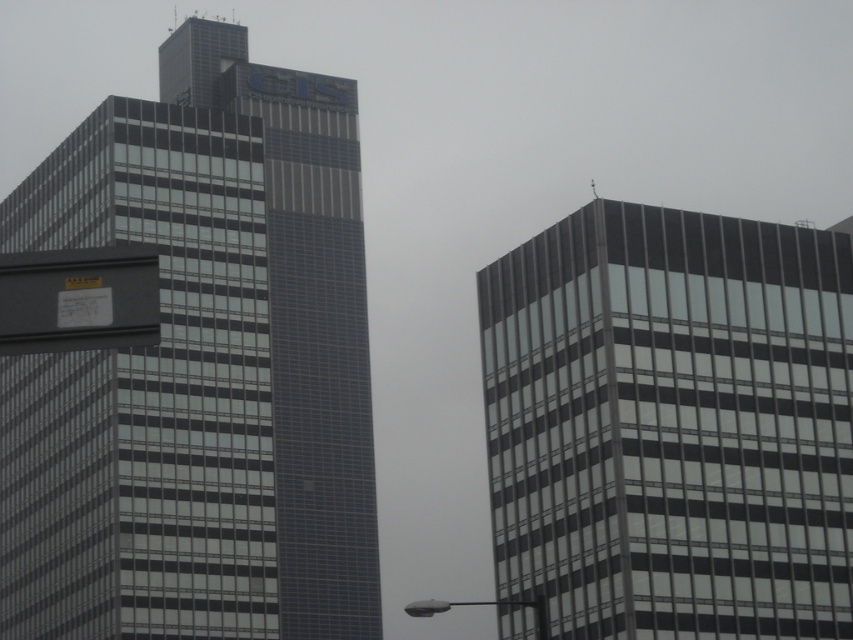
Question: Can you confirm if glassy steel skyscraper at center is positioned above black matte sign at upper left?

Choices:
 (A) yes
 (B) no

Answer: (B)

Question: Which of the following is the closest to the observer?

Choices:
 (A) glassy steel skyscraper at left
 (B) black matte sign at upper left

Answer: (B)

Question: Which object is positioned farthest from the glassy steel skyscraper at center?

Choices:
 (A) black matte sign at upper left
 (B) glassy steel skyscraper at left

Answer: (A)

Question: Which object appears farthest from the camera in this image?

Choices:
 (A) glassy steel skyscraper at left
 (B) glassy gray building at right
 (C) black matte sign at upper left
 (D) glassy steel skyscraper at center

Answer: (D)

Question: Can you confirm if glassy steel skyscraper at left is bigger than black matte sign at upper left?

Choices:
 (A) no
 (B) yes

Answer: (B)

Question: Can you confirm if glassy steel skyscraper at left is thinner than glassy steel skyscraper at center?

Choices:
 (A) no
 (B) yes

Answer: (A)